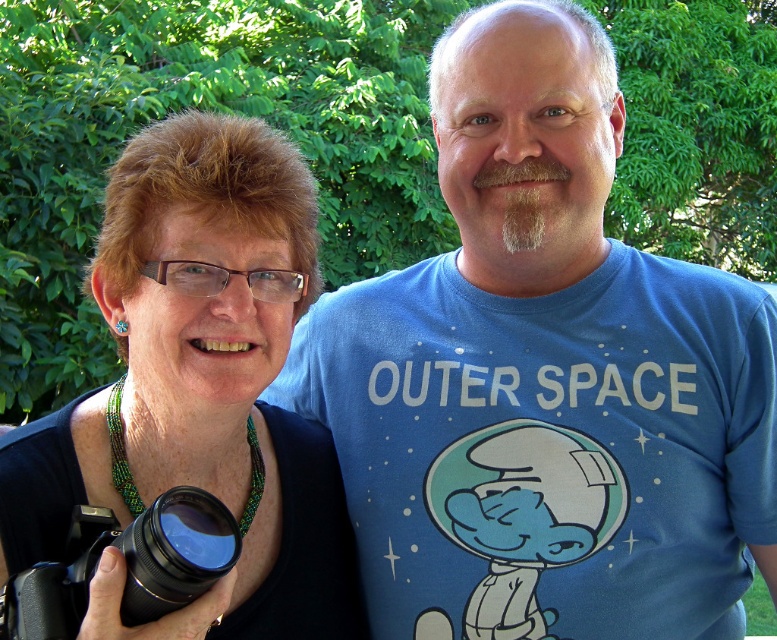
You are setting up a photography display and need to know which camera is wider to place it on a wider shelf. Which camera between the black matte camera at left and the black plastic camera at lower left is wider?

The black matte camera at left is wider than the black plastic camera at lower left, so it should be placed on the wider shelf.

You are a photographer who needs to place a 12 inch ruler between the black matte camera at left and the black plastic camera at lower left. Can you fit the ruler between them without overlapping either camera?

The distance between the black matte camera at left and the black plastic camera at lower left is 12.16 inches, so yes, the 12 inch ruler can fit between them without overlapping either camera since it is slightly longer than the ruler.

You are a photographer trying to choose between the black matte camera at left and the black plastic camera at lower left. Which one is bigger?

The black matte camera at left is larger than the black plastic camera at lower left.